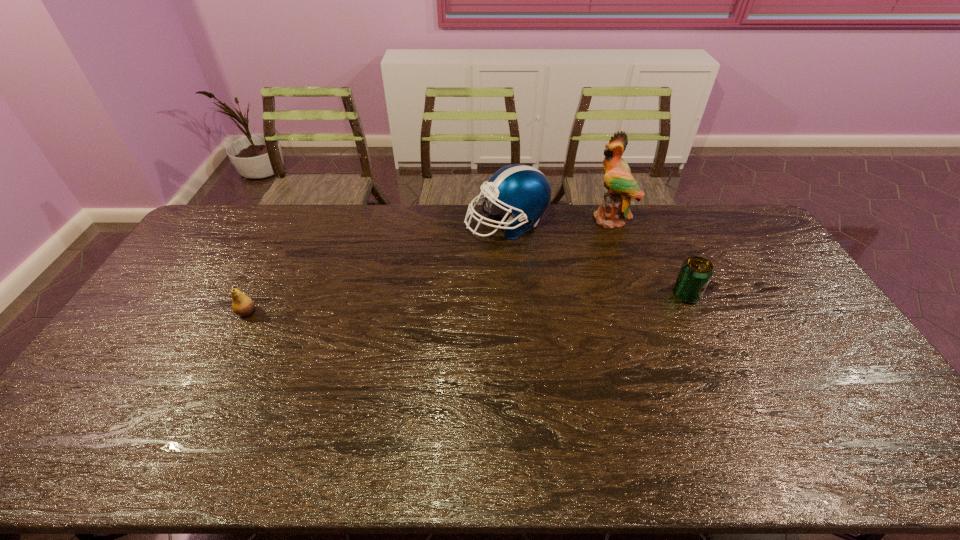
Locate an element on the screen. The width and height of the screenshot is (960, 540). vacant area that lies between the second object from left to right and the leftmost object is located at coordinates (376, 268).

The image size is (960, 540). In order to click on vacant area that lies between the third shortest object and the leftmost object in this screenshot , I will do `click(376, 268)`.

Locate an element on the screen. This screenshot has height=540, width=960. free spot between the pear and the third object from right to left is located at coordinates (376, 268).

Identify the location of vacant point located between the third shortest object and the leftmost object. (376, 268).

This screenshot has height=540, width=960. Identify the location of vacant region between the tallest object and the rightmost object. (649, 256).

Identify the location of vacant space that is in between the second tallest object and the parrot. This screenshot has width=960, height=540. (559, 221).

You are a GUI agent. You are given a task and a screenshot of the screen. Output one action in this format:
    pyautogui.click(x=<x>, y=<y>)
    Task: Click on the free space between the beer can and the leftmost object
    The width and height of the screenshot is (960, 540).
    Given the screenshot: What is the action you would take?
    pyautogui.click(x=467, y=303)

Where is `free space that is in between the pear and the parrot`? This screenshot has height=540, width=960. free space that is in between the pear and the parrot is located at coordinates (429, 265).

Identify the location of free spot between the tallest object and the third object from right to left. The width and height of the screenshot is (960, 540). (559, 221).

The height and width of the screenshot is (540, 960). Identify the location of blank region between the tallest object and the beer can. (649, 256).